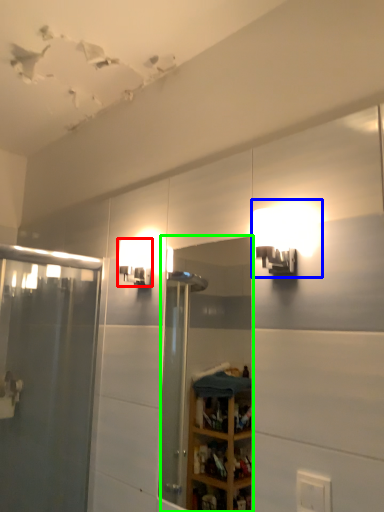
Question: Which object is positioned closest to light fixture (highlighted by a red box)? Select from light fixture (highlighted by a blue box) and mirror (highlighted by a green box).

Choices:
 (A) light fixture
 (B) mirror

Answer: (A)